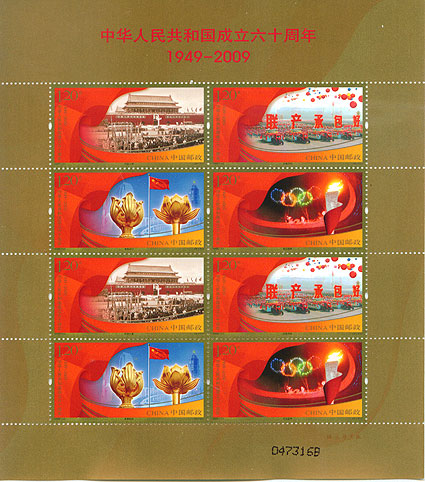
Locate an element on the screen. lanterns is located at coordinates (349, 265).